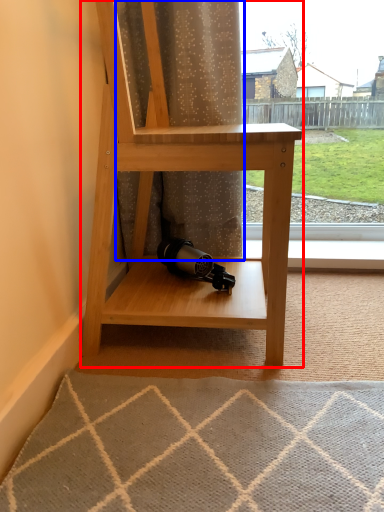
Question: Among these objects, which one is farthest to the camera, shelf (highlighted by a red box) or curtain (highlighted by a blue box)?

Choices:
 (A) shelf
 (B) curtain

Answer: (B)